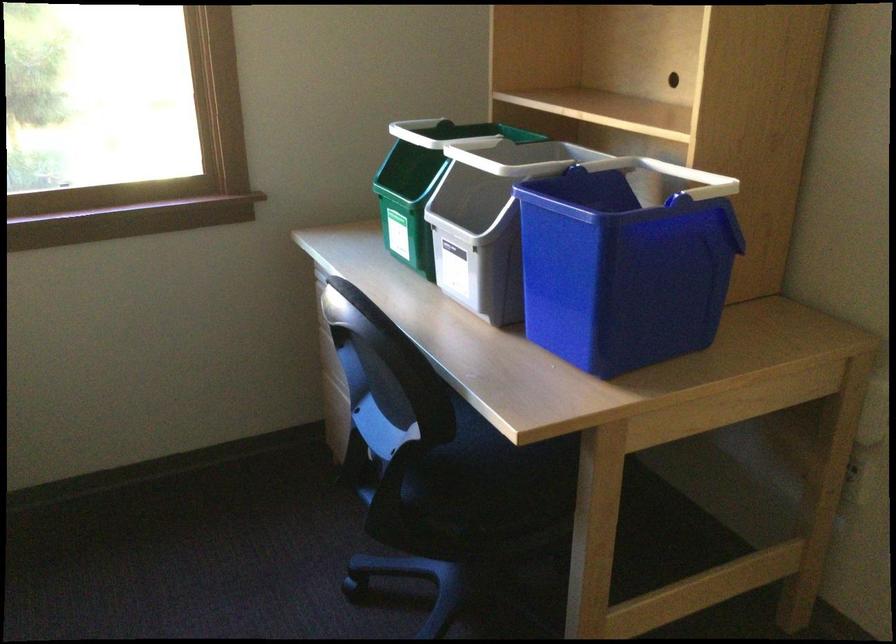
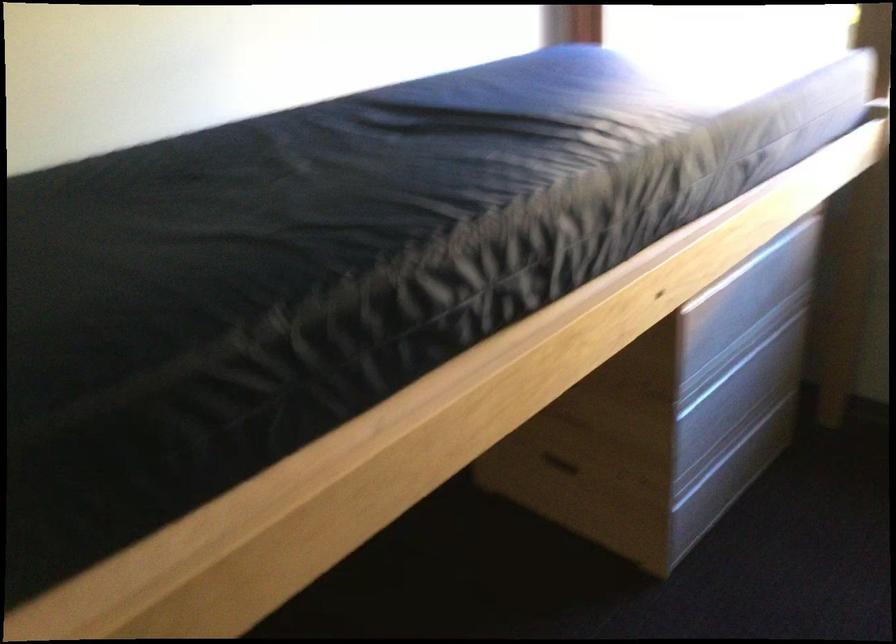
Based on the continuous images, in which direction is the camera rotating?

The camera rotated toward left-down.